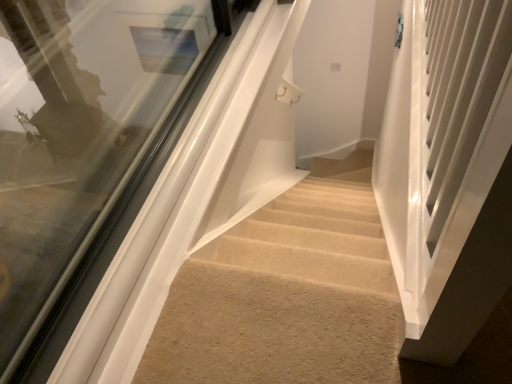
Locate an element on the screen. clear glass window at upper left is located at coordinates [86, 147].

This screenshot has width=512, height=384. What do you see at coordinates (86, 147) in the screenshot? I see `clear glass window at upper left` at bounding box center [86, 147].

In order to face clear glass window at upper left, should I rotate leftwards or rightwards?

It's best to rotate left around 4.650 degrees.

In order to click on clear glass window at upper left in this screenshot , I will do `click(86, 147)`.